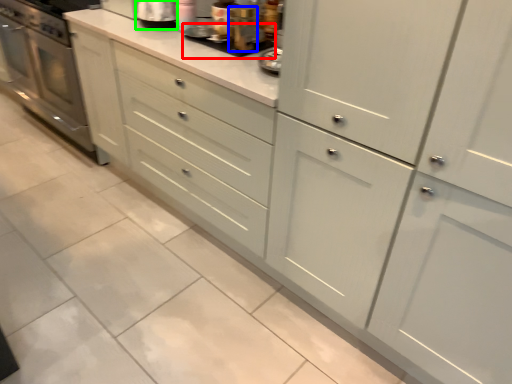
Question: Considering the real-world distances, which object is closest to appliance (highlighted by a red box)? appliance (highlighted by a blue box) or appliance (highlighted by a green box).

Choices:
 (A) appliance
 (B) appliance

Answer: (A)